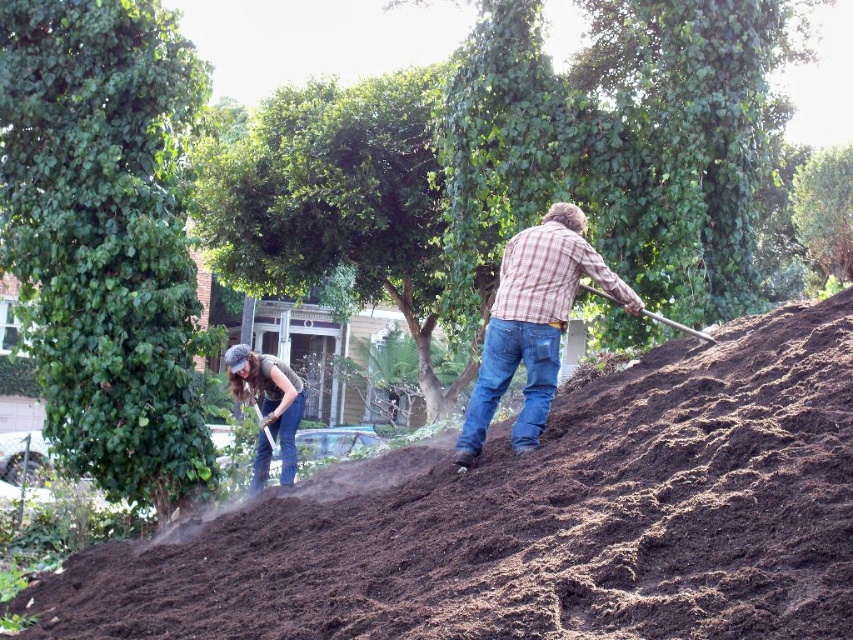
Can you confirm if plaid flannel shirt at upper center is wider than wooden shovel at upper right?

Yes, plaid flannel shirt at upper center is wider than wooden shovel at upper right.

Who is taller, plaid flannel shirt at upper center or wooden shovel at upper right?

plaid flannel shirt at upper center is taller.

Between point (579, 243) and point (608, 300), which one is positioned behind?

Point (608, 300)

Locate an element on the screen. This screenshot has width=853, height=640. plaid flannel shirt at upper center is located at coordinates (532, 323).

Between point (537, 307) and point (263, 413), which one is positioned in front?

Point (537, 307) is in front.

Does point (498, 353) come behind point (260, 448)?

No, it is in front of (260, 448).

In order to click on plaid flannel shirt at upper center in this screenshot , I will do `click(532, 323)`.

Does dark brown soil at center come behind plaid flannel shirt at upper center?

That is False.

Who is more forward, (822, 637) or (486, 326)?

Positioned in front is point (822, 637).

Where is `dark brown soil at center`? Image resolution: width=853 pixels, height=640 pixels. dark brown soil at center is located at coordinates (537, 520).